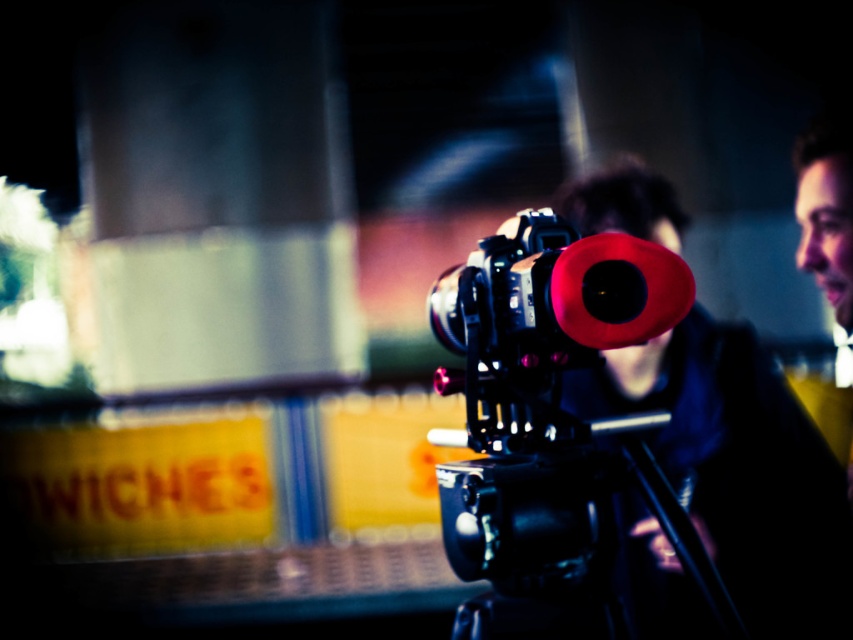
You are a camera operator who needs to adjust the camera settings. You are currently holding the smooth black jacket at center. Can you reach the camera without moving your position? Please explain your reasoning.

The smooth black jacket at center and the camera are 2.12 meters apart. Since the distance between them is over 2 meters, you cannot reach the camera while holding the jacket without moving your position.

You are a camera operator trying to adjust the tripod. You see the smooth black jacket at center and the black matte tripod at center. Which object is closer to you that you need to move first?

The smooth black jacket at center is closer to you than the black matte tripod at center, so you need to move it first before adjusting the tripod.